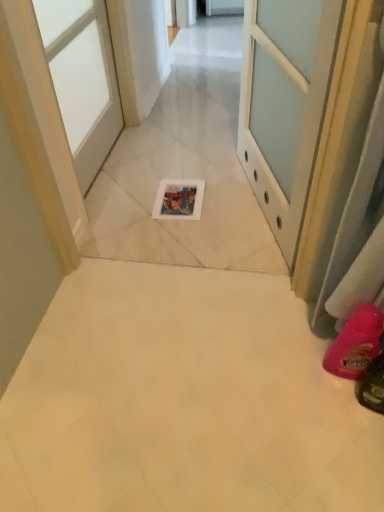
Question: Is pink rubber boot at lower right to the left or to the right of white glossy door at upper center, placed as the first door when sorted from right to left, in the image?

Choices:
 (A) left
 (B) right

Answer: (B)

Question: Is pink rubber boot at lower right wider or thinner than white glossy door at upper center, placed as the first door when sorted from right to left?

Choices:
 (A) thin
 (B) wide

Answer: (B)

Question: Considering the real-world distances, which object is closest to the white glossy door at upper left, the second door from the right?

Choices:
 (A) white glossy door at upper center, which appears as the 2th door when viewed from the left
 (B) pink rubber boot at lower right

Answer: (A)

Question: Which object is the farthest from the white glossy door at upper left, the second door from the right?

Choices:
 (A) white glossy door at upper center, which appears as the 2th door when viewed from the left
 (B) pink rubber boot at lower right

Answer: (B)